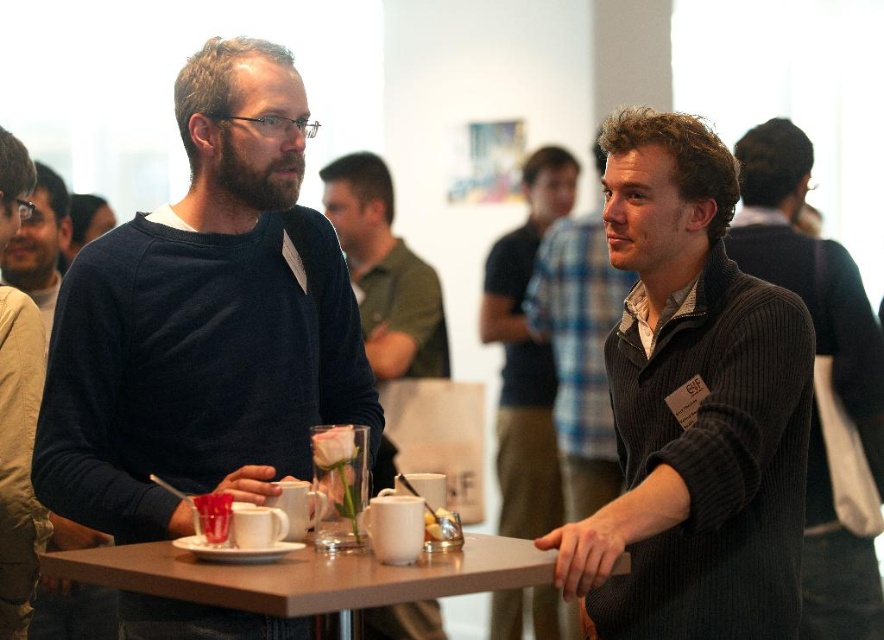
Question: Can you confirm if blue plaid shirt at center is thinner than knitted dark gray sweater at center?

Choices:
 (A) yes
 (B) no

Answer: (B)

Question: Can you confirm if blue plaid shirt at center is thinner than knitted dark gray sweater at center?

Choices:
 (A) no
 (B) yes

Answer: (A)

Question: Which point is farther to the camera?

Choices:
 (A) beige cotton shirt at left
 (B) blue plaid shirt at center
 (C) matte black sweater at left

Answer: (B)

Question: Considering the real-world distances, which object is closest to the knitted dark gray sweater at center?

Choices:
 (A) dark gray sweater at center
 (B) matte brown table at center
 (C) matte black sweater at left

Answer: (A)

Question: Which object is the closest to the dark blue sweater at left?

Choices:
 (A) matte black sweater at center
 (B) knitted dark gray sweater at center
 (C) matte brown table at center
 (D) blue plaid shirt at center

Answer: (C)

Question: Can you confirm if matte brown table at center is smaller than beige cotton shirt at left?

Choices:
 (A) yes
 (B) no

Answer: (B)